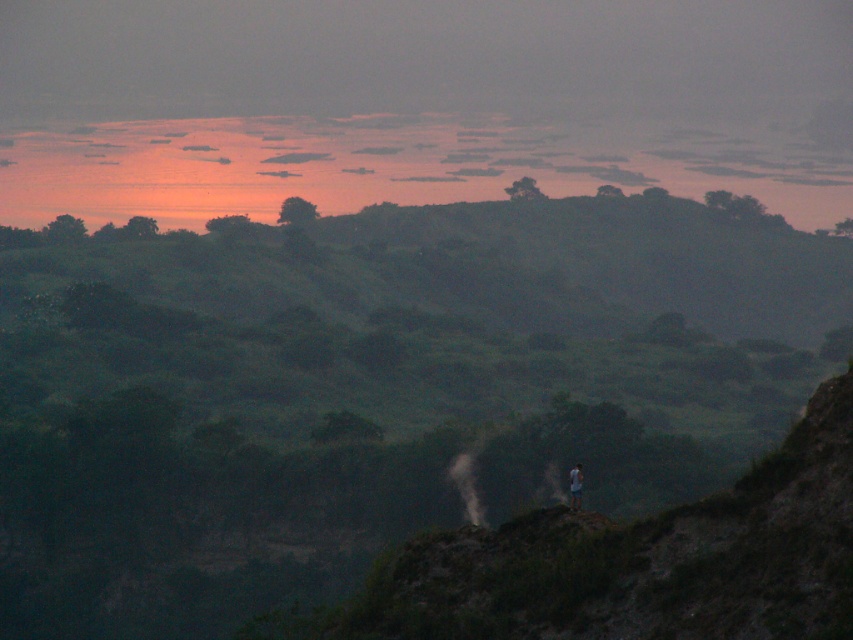
You are a photographer trying to capture the sunset scene. You notice the green grassy hill at center and the blue denim shorts at center. Which object should you focus on to ensure it takes up more space in your photo?

The green grassy hill at center is bigger than the blue denim shorts at center, so focusing on it will ensure it takes up more space in your photo.

Based on the photo, you are a photographer planning to take a landscape photo of the green grassy hill at center and the blue denim shorts at center. Which object should you focus on first if you want to capture both in sharp focus?

The green grassy hill at center is much taller than the blue denim shorts at center, so you should focus on the green grassy hill at center first to ensure both are in sharp focus.